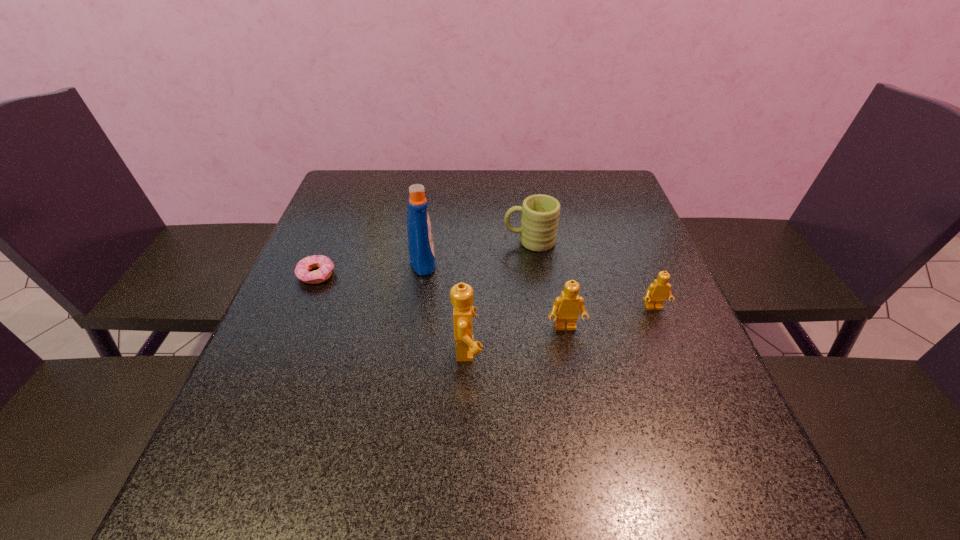
All Legos are currently evenly spaced. To continue this pattern, where would you add another Lego on the left? Please point out a vacant spot. Please provide its 2D coordinates. Your answer should be formatted as a tuple, i.e. [(x, y)], where the tuple contains the x and y coordinates of a point satisfying the conditions above.

[(361, 374)]